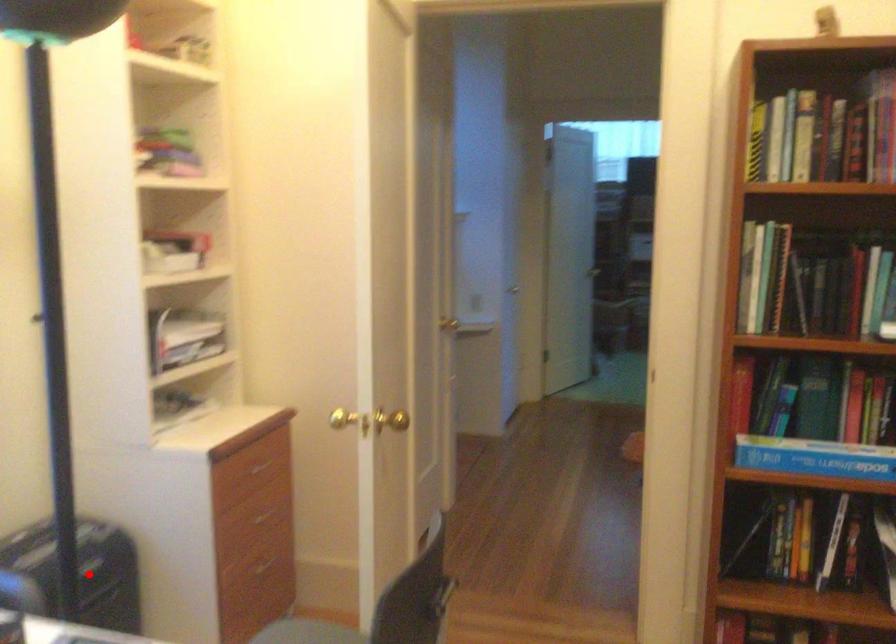
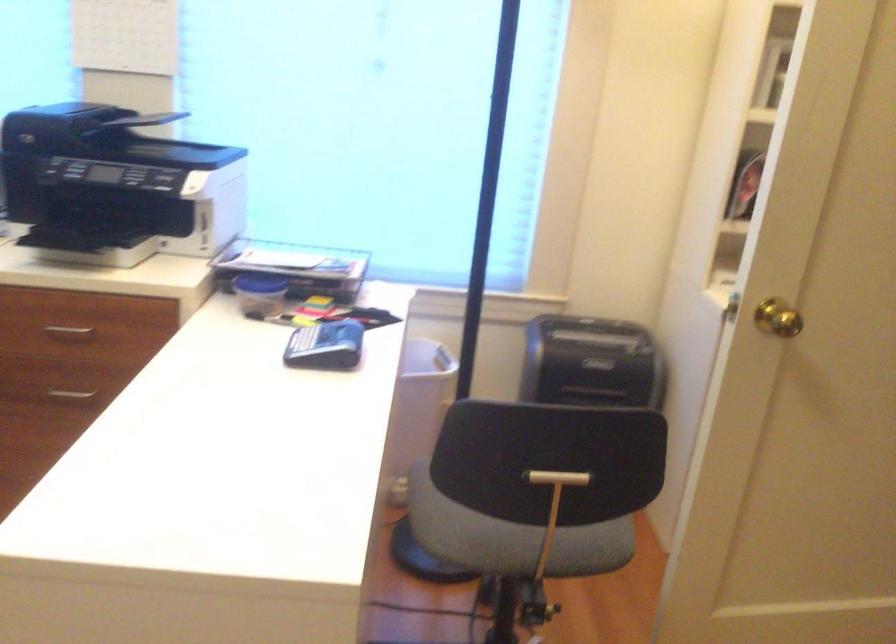
The point at the highlighted location is marked in the first image. Where is the corresponding point in the second image?

(590, 363)